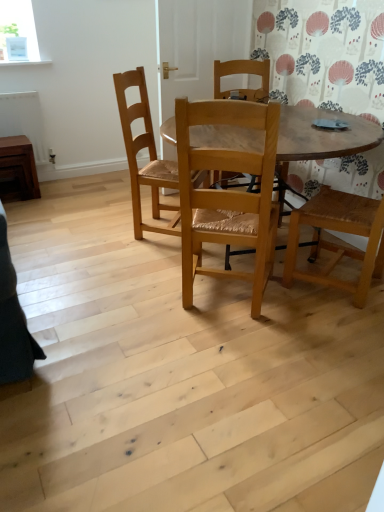
The height and width of the screenshot is (512, 384). I want to click on wooden table at center, so [x=322, y=135].

What is the approximate width of brown wooden side table at left?

brown wooden side table at left is 12.43 inches wide.

What are the coordinates of `natural wood chair at center, positioned as the 2th chair in front-to-back order` in the screenshot? It's located at (149, 155).

Where is `wooden table at center`? wooden table at center is located at coordinates (322, 135).

Is brown wooden side table at left touching natural wood chair at center, marked as the 2th chair in a back-to-front arrangement?

No, brown wooden side table at left is not in contact with natural wood chair at center, marked as the 2th chair in a back-to-front arrangement.

Is natural wood chair at center, marked as the 2th chair in a back-to-front arrangement, a part of brown wooden side table at left?

Actually, natural wood chair at center, marked as the 2th chair in a back-to-front arrangement, is outside brown wooden side table at left.

Is brown wooden side table at left smaller than natural wood chair at center, marked as the 2th chair in a back-to-front arrangement?

Correct, brown wooden side table at left occupies less space than natural wood chair at center, marked as the 2th chair in a back-to-front arrangement.

From a real-world perspective, is brown wooden side table at left physically above natural wood chair at center, marked as the 2th chair in a back-to-front arrangement?

Actually, brown wooden side table at left is physically below natural wood chair at center, marked as the 2th chair in a back-to-front arrangement, in the real world.

From the image's perspective, which is below, wooden table at center or brown wooden radiator at left?

From the image's view, wooden table at center is below.

Would you say wooden table at center is inside or outside brown wooden radiator at left?

wooden table at center is not enclosed by brown wooden radiator at left.

How different are the orientations of wooden table at center and brown wooden radiator at left in degrees?

The facing directions of wooden table at center and brown wooden radiator at left are 90 degrees apart.

What are the coordinates of `radiator that appears on the left of wooden table at center` in the screenshot? It's located at (24, 120).

Can you confirm if brown wooden side table at left is positioned to the left of natural wood chair at center, which is counted as the first chair, starting from the back?

Indeed, brown wooden side table at left is positioned on the left side of natural wood chair at center, which is counted as the first chair, starting from the back.

Is point (26, 156) less distant than point (140, 213)?

No, (26, 156) is further to viewer.

From the picture: Considering the relative sizes of brown wooden side table at left and natural wood chair at center, positioned as the 2th chair in front-to-back order, in the image provided, is brown wooden side table at left wider than natural wood chair at center, positioned as the 2th chair in front-to-back order,?

No.

Does brown wooden side table at left turn towards natural wood chair at center, which is counted as the first chair, starting from the back?

No, brown wooden side table at left does not turn towards natural wood chair at center, which is counted as the first chair, starting from the back.

Is brown wooden radiator at left shorter than natural wood chair at center, marked as the 2th chair in a back-to-front arrangement?

Correct, brown wooden radiator at left is not as tall as natural wood chair at center, marked as the 2th chair in a back-to-front arrangement.

Relative to natural wood chair at center, the 1th chair in the front-to-back sequence, is brown wooden radiator at left in front or behind?

Clearly, brown wooden radiator at left is behind natural wood chair at center, the 1th chair in the front-to-back sequence.

Based on the photo, is natural wood chair at center, marked as the 2th chair in a back-to-front arrangement, at the back of brown wooden radiator at left?

No, brown wooden radiator at left is not facing the opposite direction of natural wood chair at center, marked as the 2th chair in a back-to-front arrangement.

Based on the photo, from the image's perspective, is brown wooden radiator at left over natural wood chair at center, the 1th chair in the front-to-back sequence?

Yes, from the image's perspective, brown wooden radiator at left is over natural wood chair at center, the 1th chair in the front-to-back sequence.

In terms of width, does wooden table at center look wider or thinner when compared to natural wood chair at center, which is counted as the first chair, starting from the back?

Considering their sizes, wooden table at center looks broader than natural wood chair at center, which is counted as the first chair, starting from the back.

Between wooden table at center and natural wood chair at center, which is counted as the first chair, starting from the back, which one has smaller size?

natural wood chair at center, which is counted as the first chair, starting from the back, is smaller.

From their relative heights in the image, would you say wooden table at center is taller or shorter than natural wood chair at center, which is counted as the first chair, starting from the back?

In the image, wooden table at center appears to be shorter than natural wood chair at center, which is counted as the first chair, starting from the back.

Does brown wooden radiator at left have a larger size compared to brown wooden side table at left?

Yes, brown wooden radiator at left is bigger than brown wooden side table at left.

From the image's perspective, is brown wooden radiator at left under brown wooden side table at left?

Actually, brown wooden radiator at left appears above brown wooden side table at left in the image.

From the picture: Between brown wooden radiator at left and brown wooden side table at left, which one appears on the left side from the viewer's perspective?

brown wooden side table at left is more to the left.

What's the angular difference between brown wooden radiator at left and brown wooden side table at left's facing directions?

0.472 degrees.

Considering the sizes of objects natural wood chair at center, positioned as the 2th chair in front-to-back order, and natural wood chair at center, marked as the 2th chair in a back-to-front arrangement, in the image provided, who is smaller, natural wood chair at center, positioned as the 2th chair in front-to-back order, or natural wood chair at center, marked as the 2th chair in a back-to-front arrangement,?

natural wood chair at center, positioned as the 2th chair in front-to-back order.

Which object is more forward, natural wood chair at center, positioned as the 2th chair in front-to-back order, or natural wood chair at center, the 1th chair in the front-to-back sequence?

natural wood chair at center, the 1th chair in the front-to-back sequence, is in front.

Can you confirm if natural wood chair at center, positioned as the 2th chair in front-to-back order, is thinner than natural wood chair at center, the 1th chair in the front-to-back sequence?

Yes, natural wood chair at center, positioned as the 2th chair in front-to-back order, is thinner than natural wood chair at center, the 1th chair in the front-to-back sequence.

Considering the relative sizes of natural wood chair at center, which is counted as the first chair, starting from the back, and natural wood chair at center, marked as the 2th chair in a back-to-front arrangement, in the image provided, is natural wood chair at center, which is counted as the first chair, starting from the back, shorter than natural wood chair at center, marked as the 2th chair in a back-to-front arrangement,?

Yes.

From the image's perspective, count 2nd chairs downward from the brown wooden side table at left and point to it. Please provide its 2D coordinates.

[(227, 193)]

The height and width of the screenshot is (512, 384). What are the coordinates of `kitchen & dining room table on the right of the brown wooden radiator at left` in the screenshot? It's located at (322, 135).

From the image, which object appears to be nearer to brown wooden radiator at left, brown wooden side table at left or natural wood chair at center, the 1th chair in the front-to-back sequence?

brown wooden side table at left is positioned closer to the anchor brown wooden radiator at left.

From the image, which object appears to be nearer to brown wooden radiator at left, natural wood chair at center, which is counted as the first chair, starting from the back, or wooden table at center?

natural wood chair at center, which is counted as the first chair, starting from the back, lies closer to brown wooden radiator at left than the other object.

From the image, which object appears to be farther from natural wood chair at center, which is counted as the first chair, starting from the back, brown wooden radiator at left or wooden table at center?

The object further to natural wood chair at center, which is counted as the first chair, starting from the back, is brown wooden radiator at left.

From the image, which object appears to be nearer to brown wooden side table at left, brown wooden radiator at left or natural wood chair at center, which is counted as the first chair, starting from the back?

brown wooden radiator at left.

Looking at the image, which one is located closer to wooden table at center, brown wooden side table at left or natural wood chair at center, positioned as the 2th chair in front-to-back order?

The object closer to wooden table at center is natural wood chair at center, positioned as the 2th chair in front-to-back order.

Considering their positions, is wooden table at center positioned further to natural wood chair at center, which is counted as the first chair, starting from the back, than brown wooden radiator at left?

brown wooden radiator at left is further to natural wood chair at center, which is counted as the first chair, starting from the back.

Which object lies further to the anchor point brown wooden radiator at left, natural wood chair at center, which is counted as the first chair, starting from the back, or brown wooden side table at left?

natural wood chair at center, which is counted as the first chair, starting from the back, lies further to brown wooden radiator at left than the other object.

Which object lies further to the anchor point wooden table at center, natural wood chair at center, positioned as the 2th chair in front-to-back order, or natural wood chair at center, marked as the 2th chair in a back-to-front arrangement?

natural wood chair at center, positioned as the 2th chair in front-to-back order, is positioned further to the anchor wooden table at center.

The width and height of the screenshot is (384, 512). Find the location of `radiator between brown wooden side table at left and wooden table at center from left to right`. radiator between brown wooden side table at left and wooden table at center from left to right is located at coordinates [x=24, y=120].

This screenshot has width=384, height=512. Identify the location of chair between natural wood chair at center, the 1th chair in the front-to-back sequence, and brown wooden radiator at left, along the z-axis. (149, 155).

The width and height of the screenshot is (384, 512). I want to click on radiator between brown wooden side table at left and natural wood chair at center, positioned as the 2th chair in front-to-back order, so [x=24, y=120].

The height and width of the screenshot is (512, 384). I want to click on kitchen & dining room table between natural wood chair at center, marked as the 2th chair in a back-to-front arrangement, and natural wood chair at center, which is counted as the first chair, starting from the back, along the z-axis, so click(x=322, y=135).